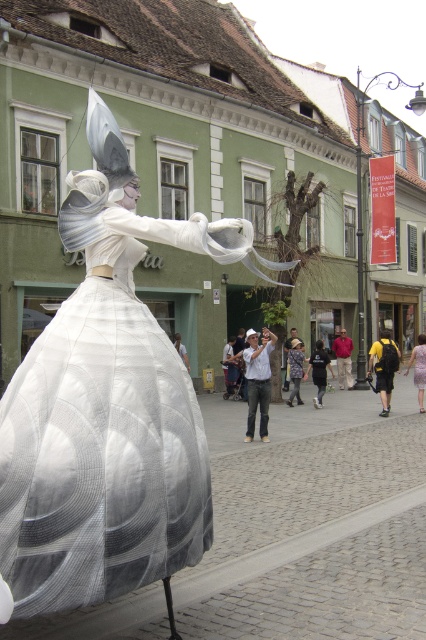
You are a photographer positioned at point (x=103, y=442). You want to capture the white sheer dress at center in your shot. What is the location of the white sheer dress at center relative to your current position?

The white sheer dress at center is located at point (x=103, y=442), which is your current position, so you are already at the location of the white sheer dress at center.